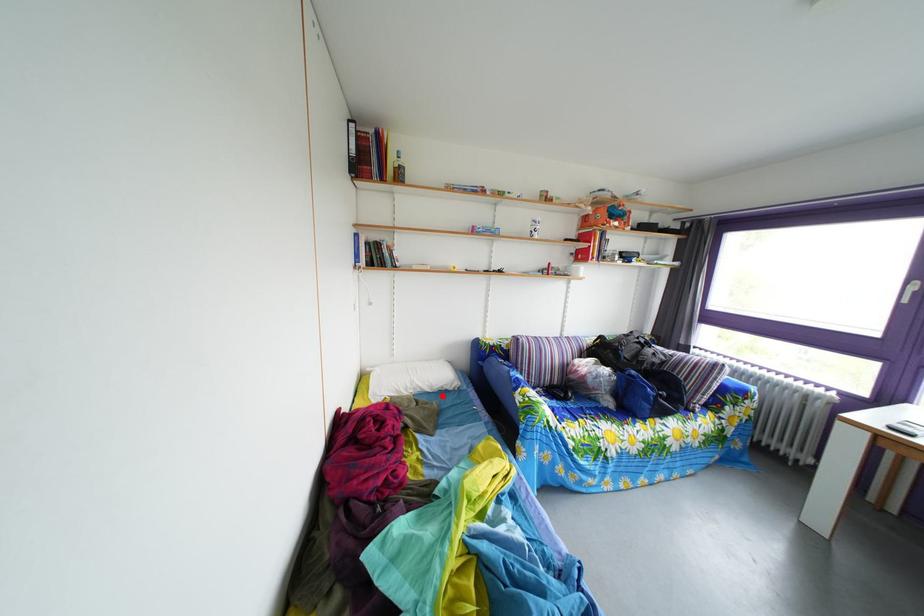
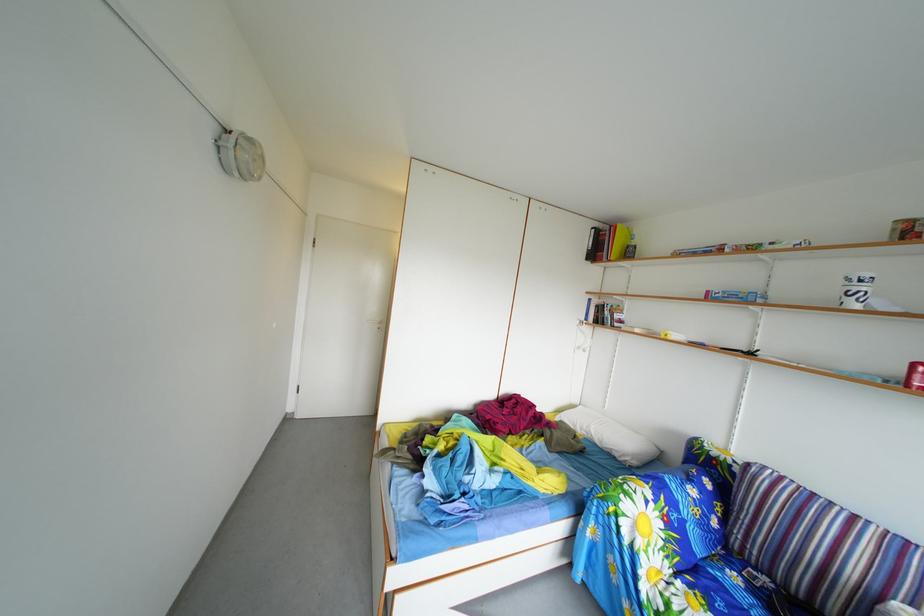
Question: I am providing you with two images of the same scene from different viewpoints. A red point is shown in image1. For the corresponding object point in image2, is it positioned nearer or farther from the camera?

Choices:
 (A) Nearer
 (B) Farther

Answer: (B)